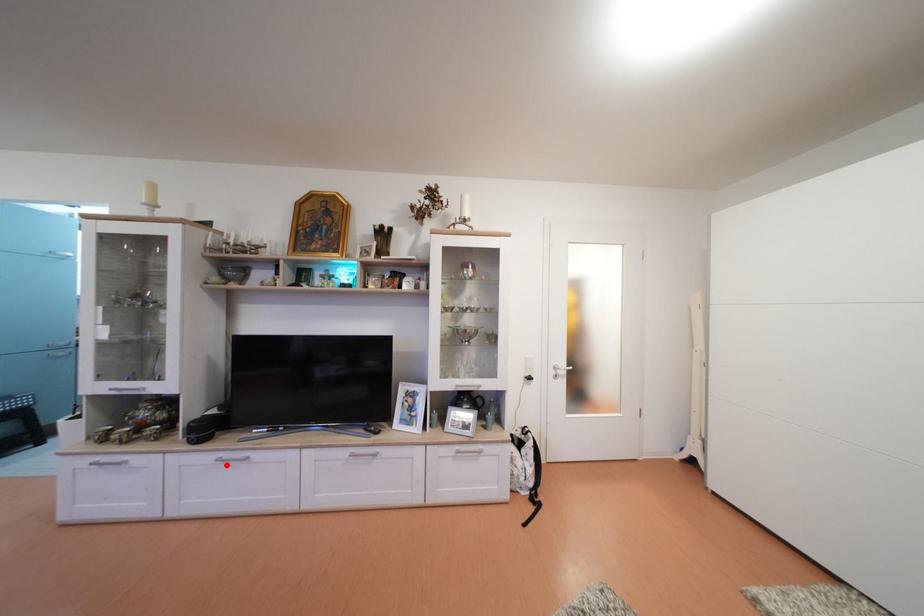
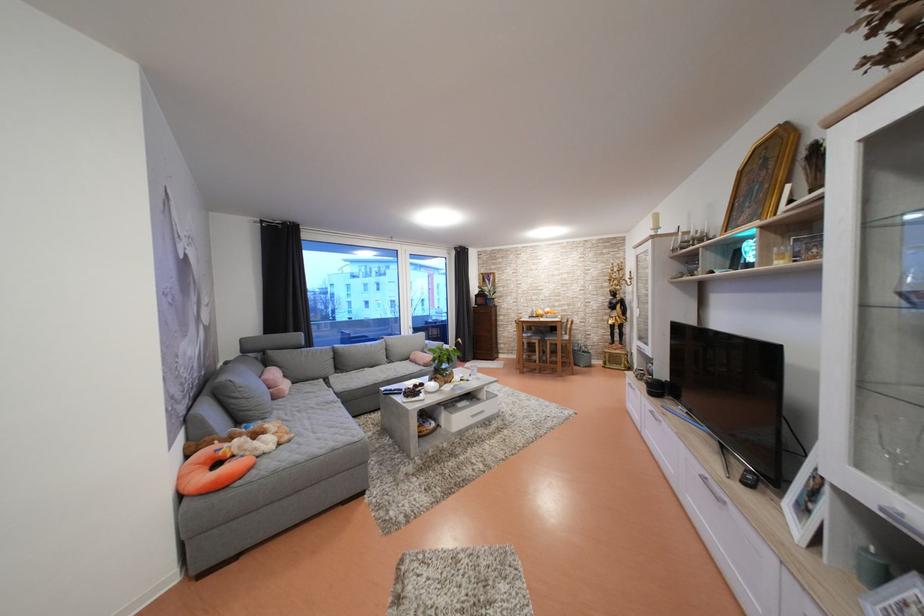
Question: I am providing you with two images of the same scene from different viewpoints. Given a red point in image1, look at the same physical point in image2. Is it:

Choices:
 (A) Closer to the viewpoint
 (B) Farther from the viewpoint

Answer: (A)